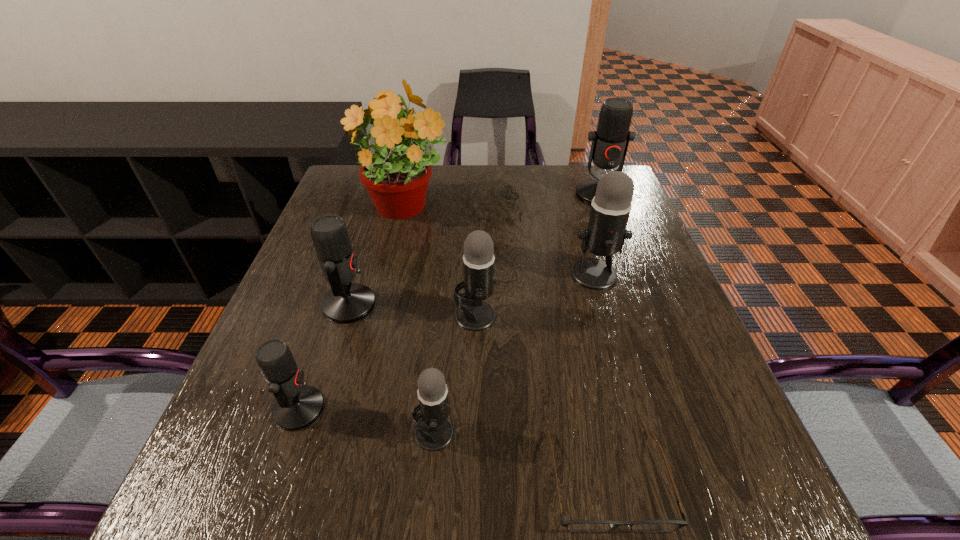
Identify the location of vacant space that satisfies the following two spatial constraints: 1. on the back side of the smallest gray microphone; 2. on the side of the smallest red microphone with the red ring. The width and height of the screenshot is (960, 540). (436, 409).

Locate an element on the screen. This screenshot has width=960, height=540. vacant region that satisfies the following two spatial constraints: 1. on the side of the second smallest red microphone with the red ring; 2. on the back side of the second farthest gray microphone is located at coordinates (346, 315).